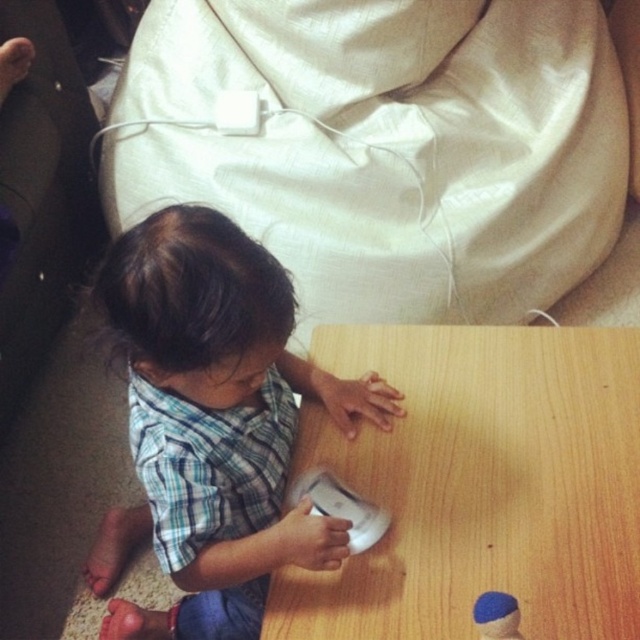
Question: Which object is positioned closest to the blue felt hat at lower right?

Choices:
 (A) white matte wii remote at center
 (B) blue plaid shirt at center
 (C) wooden table at center

Answer: (A)

Question: Which of the following is the closest to the observer?

Choices:
 (A) blue plaid shirt at center
 (B) blue felt hat at lower right

Answer: (A)

Question: Estimate the real-world distances between objects in this image. Which object is closer to the blue felt hat at lower right?

Choices:
 (A) white matte wii remote at center
 (B) wooden table at center

Answer: (A)

Question: Is white matte wii remote at center smaller than blue felt hat at lower right?

Choices:
 (A) yes
 (B) no

Answer: (B)

Question: Can you confirm if wooden table at center is smaller than blue plaid shirt at center?

Choices:
 (A) no
 (B) yes

Answer: (B)

Question: Can you confirm if blue plaid shirt at center is smaller than blue felt hat at lower right?

Choices:
 (A) yes
 (B) no

Answer: (B)